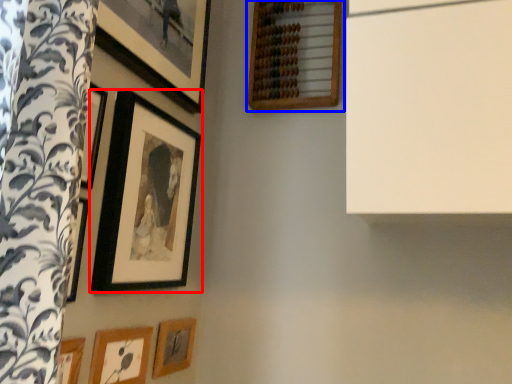
Question: Which of the following is the closest to the observer, picture frame (highlighted by a red box) or picture frame (highlighted by a blue box)?

Choices:
 (A) picture frame
 (B) picture frame

Answer: (A)